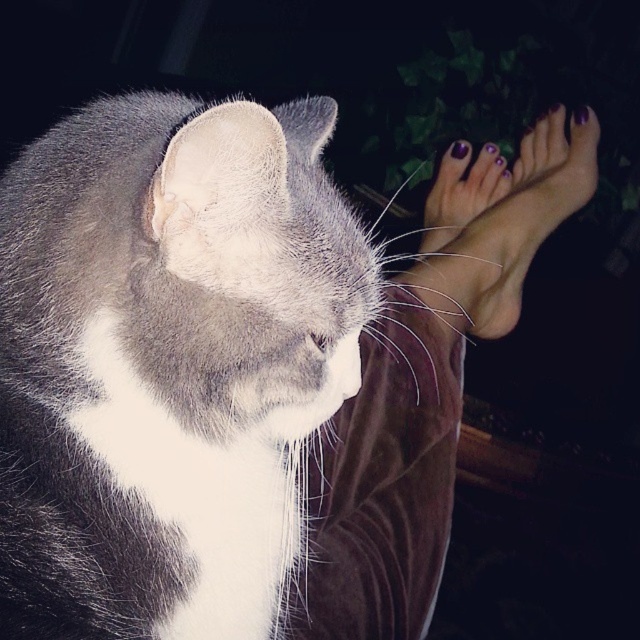
You are a photographer trying to capture a close detail shot of the purple painted nails at upper right and the purple painted toe at upper right. Which object should you zoom in on to ensure the subject fits within the frame without cropping?

The purple painted toe at upper right has a smaller width compared to the purple painted nails at upper right. Therefore, to ensure the subject fits within the frame without cropping, you should zoom in on the purple painted toe at upper right.

Based on the photo, you are taking a photo of the scene and want to focus on the closest point between point (198, 470) and point (465, 147). Which point should you focus on?

Point (198, 470) is closer to the camera than point (465, 147), so you should focus on point (198, 470).